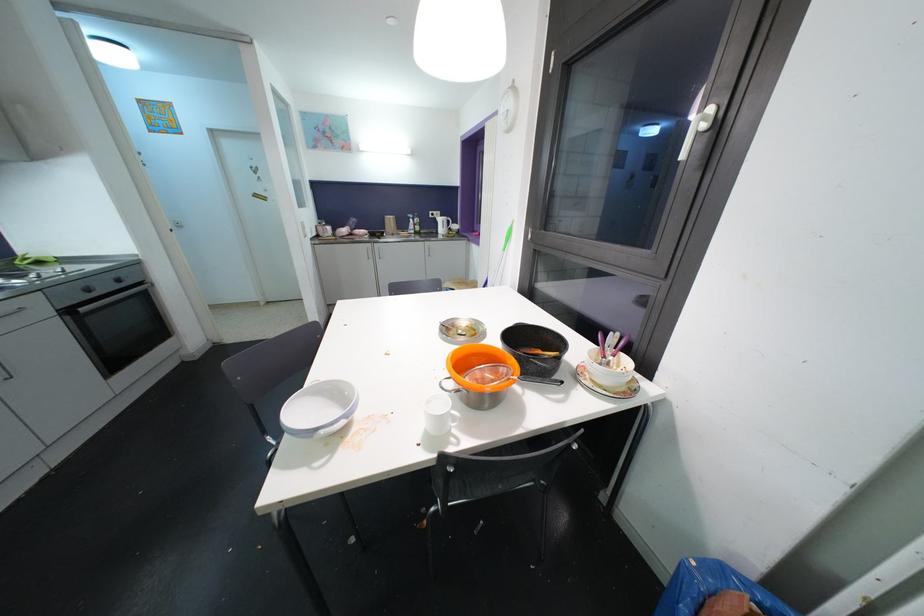
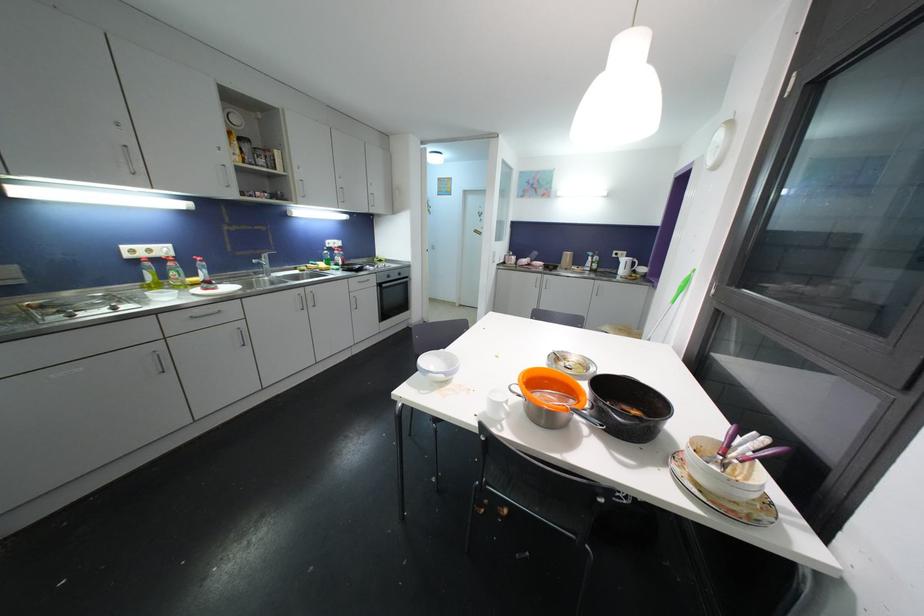
Question: The images are taken continuously from a first-person perspective. In which direction is your viewpoint rotating?

Choices:
 (A) Left
 (B) Right
 (C) Up
 (D) Down

Answer: (A)